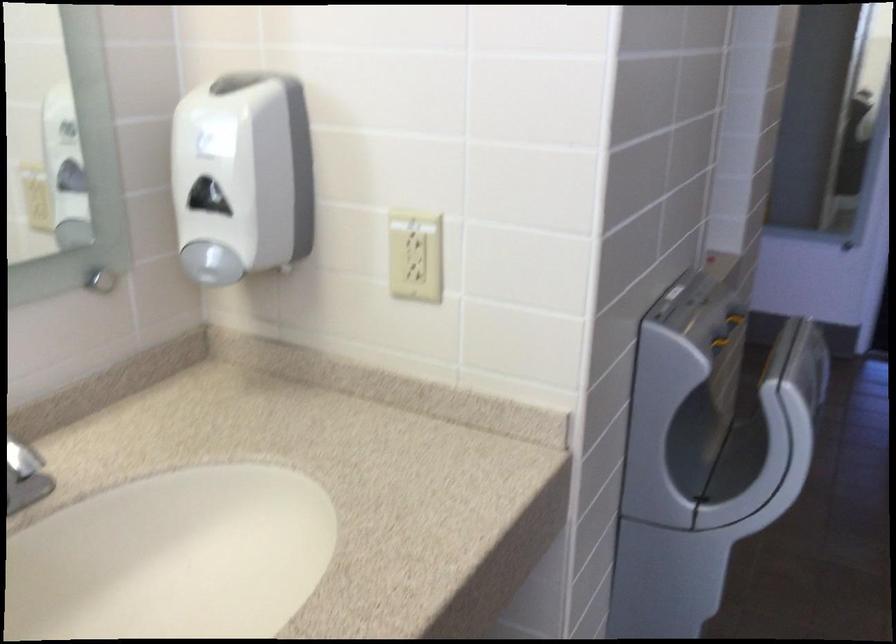
At what (x,y) coordinates should I click in order to perform the action: click on faucet handle. Please return your answer as a coordinate pair (x, y). Looking at the image, I should click on (23, 460).